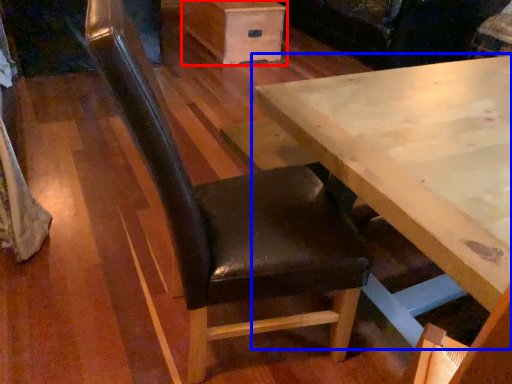
Question: Which object is further to the camera taking this photo, drawer (highlighted by a red box) or table (highlighted by a blue box)?

Choices:
 (A) drawer
 (B) table

Answer: (A)